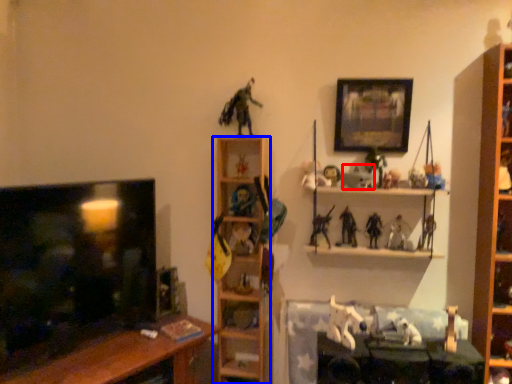
Question: Which object appears farthest to the camera in this image, toy (highlighted by a red box) or shelf (highlighted by a blue box)?

Choices:
 (A) toy
 (B) shelf

Answer: (B)